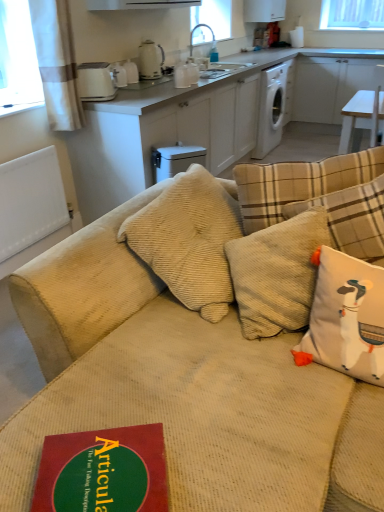
Find the location of `white textured curtain at upper left`. white textured curtain at upper left is located at coordinates (57, 63).

What do you see at coordinates (138, 4) in the screenshot?
I see `white glossy exhaust hood at upper center` at bounding box center [138, 4].

Describe the element at coordinates (202, 120) in the screenshot. I see `matte white cabinet at upper center` at that location.

Describe the element at coordinates (183, 387) in the screenshot. I see `beige corduroy couch at center` at that location.

The image size is (384, 512). What do you see at coordinates (150, 60) in the screenshot?
I see `white glossy electric kettle at upper center, the second appliance viewed from the right` at bounding box center [150, 60].

What is the approximate height of white plastic toaster at upper left, arranged as the 4th appliance when viewed from the right?

It is 22.20 centimeters.

Describe the element at coordinates (95, 82) in the screenshot. This screenshot has width=384, height=512. I see `white plastic toaster at upper left, which appears as the 1th appliance when viewed from the left` at that location.

The width and height of the screenshot is (384, 512). Describe the element at coordinates (103, 471) in the screenshot. I see `red matte paper at lower left` at that location.

Where is `white textured curtain at upper left`? This screenshot has height=512, width=384. white textured curtain at upper left is located at coordinates (57, 63).

Does matte white cabinet at upper center touch beige corduroy couch at center?

matte white cabinet at upper center and beige corduroy couch at center are clearly separated.

From the image's perspective, which one is positioned lower, matte white cabinet at upper center or beige corduroy couch at center?

beige corduroy couch at center is shown below in the image.

How much distance is there between matte white cabinet at upper center and beige corduroy couch at center?

matte white cabinet at upper center is 5.05 feet from beige corduroy couch at center.

Is matte white cabinet at upper center looking in the opposite direction of beige corduroy couch at center?

No, matte white cabinet at upper center's orientation is not away from beige corduroy couch at center.

Who is bigger, white plastic dishwasher at center or white plastic toaster at upper left, which appears as the 1th appliance when viewed from the left?

white plastic dishwasher at center.

From the image's perspective, which is below, white plastic dishwasher at center or white plastic toaster at upper left, which appears as the 1th appliance when viewed from the left?

white plastic dishwasher at center, from the image's perspective.

Considering the relative positions of white plastic dishwasher at center and white plastic toaster at upper left, which appears as the 1th appliance when viewed from the left, in the image provided, is white plastic dishwasher at center to the right of white plastic toaster at upper left, which appears as the 1th appliance when viewed from the left, from the viewer's perspective?

Yes, white plastic dishwasher at center is to the right of white plastic toaster at upper left, which appears as the 1th appliance when viewed from the left.

Is white plastic dishwasher at center not close to white plastic toaster at upper left, arranged as the 4th appliance when viewed from the right?

No, white plastic dishwasher at center is not far away from white plastic toaster at upper left, arranged as the 4th appliance when viewed from the right.

From the image's perspective, is white glossy exhaust hood at upper center over white glossy electric kettle at upper center, the second appliance viewed from the right?

Indeed, from the image's perspective, white glossy exhaust hood at upper center is shown above white glossy electric kettle at upper center, the second appliance viewed from the right.

Consider the image. Is white glossy exhaust hood at upper center not close to white glossy electric kettle at upper center, the second appliance viewed from the right?

No, white glossy exhaust hood at upper center is not far away from white glossy electric kettle at upper center, the second appliance viewed from the right.

Considering the sizes of objects white glossy exhaust hood at upper center and white glossy electric kettle at upper center, acting as the 3th appliance starting from the left, in the image provided, who is taller, white glossy exhaust hood at upper center or white glossy electric kettle at upper center, acting as the 3th appliance starting from the left,?

white glossy electric kettle at upper center, acting as the 3th appliance starting from the left, is taller.

Is beige corduroy couch at center bigger than white plastic toaster at upper left, arranged as the 4th appliance when viewed from the right?

Yes, beige corduroy couch at center is bigger than white plastic toaster at upper left, arranged as the 4th appliance when viewed from the right.

Considering the sizes of objects beige corduroy couch at center and white plastic toaster at upper left, which appears as the 1th appliance when viewed from the left, in the image provided, who is wider, beige corduroy couch at center or white plastic toaster at upper left, which appears as the 1th appliance when viewed from the left,?

With larger width is beige corduroy couch at center.

Is beige corduroy couch at center inside the boundaries of white plastic toaster at upper left, arranged as the 4th appliance when viewed from the right, or outside?

beige corduroy couch at center exists outside the volume of white plastic toaster at upper left, arranged as the 4th appliance when viewed from the right.

Which is behind, beige corduroy couch at center or white plastic toaster at upper left, which appears as the 1th appliance when viewed from the left?

white plastic toaster at upper left, which appears as the 1th appliance when viewed from the left, is behind.

Is matte white cabinet at upper center positioned with its back to white plastic dishwasher at center?

No, matte white cabinet at upper center is not facing the opposite direction of white plastic dishwasher at center.

Considering the sizes of matte white cabinet at upper center and white plastic dishwasher at center in the image, is matte white cabinet at upper center bigger or smaller than white plastic dishwasher at center?

Clearly, matte white cabinet at upper center is larger in size than white plastic dishwasher at center.

How much distance is there between matte white cabinet at upper center and white plastic dishwasher at center?

matte white cabinet at upper center and white plastic dishwasher at center are 35.67 centimeters apart.

Considering the relative sizes of matte white cabinet at upper center and white plastic dishwasher at center in the image provided, is matte white cabinet at upper center thinner than white plastic dishwasher at center?

No, matte white cabinet at upper center is not thinner than white plastic dishwasher at center.

Is white plastic toaster at upper left, arranged as the 4th appliance when viewed from the right, positioned with its back to white glossy kettle at upper center, the 1th appliance positioned from the right?

No, white plastic toaster at upper left, arranged as the 4th appliance when viewed from the right, is not facing away from white glossy kettle at upper center, the 1th appliance positioned from the right.

From a real-world perspective, is white plastic toaster at upper left, which appears as the 1th appliance when viewed from the left, positioned above or below white glossy kettle at upper center, the 1th appliance positioned from the right?

white plastic toaster at upper left, which appears as the 1th appliance when viewed from the left, is situated higher than white glossy kettle at upper center, the 1th appliance positioned from the right, in the real world.

Is white plastic toaster at upper left, arranged as the 4th appliance when viewed from the right, further to camera compared to white glossy kettle at upper center, the 1th appliance positioned from the right?

No, it is not.

Based on the photo, is white plastic toaster at upper left, which appears as the 1th appliance when viewed from the left, touching white glossy kettle at upper center, the 1th appliance positioned from the right?

No, white plastic toaster at upper left, which appears as the 1th appliance when viewed from the left, is not beside white glossy kettle at upper center, the 1th appliance positioned from the right.

Is point (142, 6) closer or farther from the camera than point (307, 55)?

Point (142, 6).

Could you tell me if white glossy exhaust hood at upper center is turned towards matte white cabinet at upper center?

No, white glossy exhaust hood at upper center is not oriented towards matte white cabinet at upper center.

Looking at this image, from the image's perspective, is white glossy exhaust hood at upper center beneath matte white cabinet at upper center?

No, from the image's perspective, white glossy exhaust hood at upper center is not below matte white cabinet at upper center.

In the scene shown: How far apart are white glossy exhaust hood at upper center and matte white cabinet at upper center?

They are 30.86 inches apart.

This screenshot has width=384, height=512. In the image, there is a beige corduroy couch at center. What are the coordinates of `cabinetry below it (from a real-world perspective)` in the screenshot? It's located at (202, 120).

This screenshot has width=384, height=512. I want to click on dish washer below the white plastic toaster at upper left, which appears as the 1th appliance when viewed from the left (from the image's perspective), so click(175, 160).

Based on their spatial positions, is beige corduroy couch at center or matte white cabinet at upper center further from white glossy exhaust hood at upper center?

Based on the image, beige corduroy couch at center appears to be further to white glossy exhaust hood at upper center.

From the image, which object appears to be nearer to white corduroy pillow at right, matte white cabinet at upper center or white plastic dishwasher at center?

white plastic dishwasher at center.

Considering their positions, is white glossy kettle at upper center, the 1th appliance positioned from the right, positioned closer to beige corduroy couch at center than red matte paper at lower left?

red matte paper at lower left is positioned closer to the anchor beige corduroy couch at center.

Which object lies further to the anchor point matte white cabinet at upper center, white glossy exhaust hood at upper center or white plastic toaster at upper left, which appears as the 1th appliance when viewed from the left?

white glossy exhaust hood at upper center is positioned further to the anchor matte white cabinet at upper center.

Considering their positions, is beige corduroy couch at center positioned further to white textured curtain at upper left than white ceramic kettle at upper center, the second appliance from the left?

beige corduroy couch at center is positioned further to the anchor white textured curtain at upper left.

Which object lies nearer to the anchor point white plastic dishwasher at center, white glossy exhaust hood at upper center or red matte paper at lower left?

white glossy exhaust hood at upper center.

Which object lies nearer to the anchor point white glossy exhaust hood at upper center, white textured curtain at upper left or white ceramic kettle at upper center, the second appliance from the left?

white ceramic kettle at upper center, the second appliance from the left, is positioned closer to the anchor white glossy exhaust hood at upper center.

When comparing their distances from white plastic toaster at upper left, which appears as the 1th appliance when viewed from the left, does beige corduroy couch at center or white glossy exhaust hood at upper center seem closer?

Among the two, white glossy exhaust hood at upper center is located nearer to white plastic toaster at upper left, which appears as the 1th appliance when viewed from the left.

Where is `cabinetry positioned between beige corduroy couch at center and white plastic dishwasher at center from near to far`? The width and height of the screenshot is (384, 512). cabinetry positioned between beige corduroy couch at center and white plastic dishwasher at center from near to far is located at coordinates (202, 120).

Identify the location of dish washer between beige corduroy couch at center and white glossy kettle at upper center, which appears as the fourth appliance when viewed from the left, from front to back. This screenshot has width=384, height=512. (175, 160).

This screenshot has width=384, height=512. What are the coordinates of `dish washer located between beige corduroy couch at center and white glossy electric kettle at upper center, acting as the 3th appliance starting from the left, in the depth direction` in the screenshot? It's located at (175, 160).

The width and height of the screenshot is (384, 512). Identify the location of dish washer between red matte paper at lower left and white glossy kettle at upper center, the 1th appliance positioned from the right, along the z-axis. (175, 160).